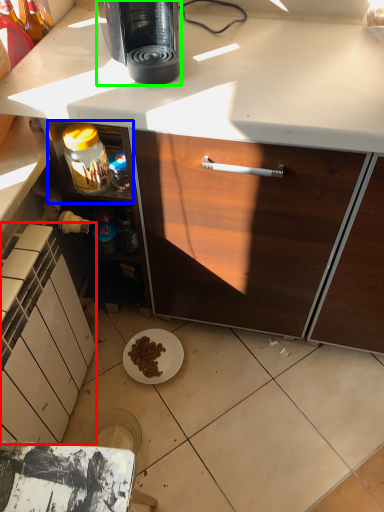
Question: Which object is the closest to the cabinetry (highlighted by a red box)? Choose among these: shelf (highlighted by a blue box) or coffee maker (highlighted by a green box).

Choices:
 (A) shelf
 (B) coffee maker

Answer: (A)